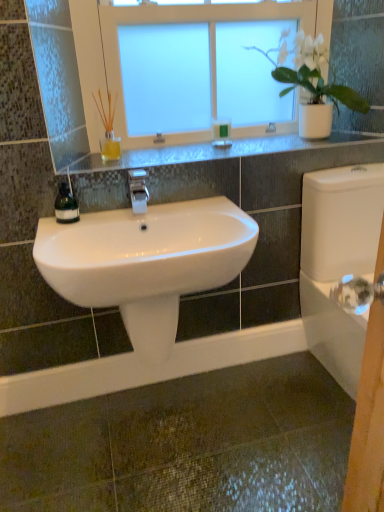
This screenshot has width=384, height=512. What are the coordinates of `free space in front of green matte soap at upper center` in the screenshot? It's located at (226, 155).